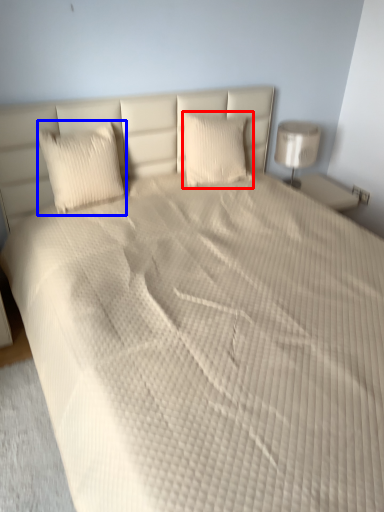
Question: Which object appears farthest to the camera in this image, pillow (highlighted by a red box) or pillow (highlighted by a blue box)?

Choices:
 (A) pillow
 (B) pillow

Answer: (A)